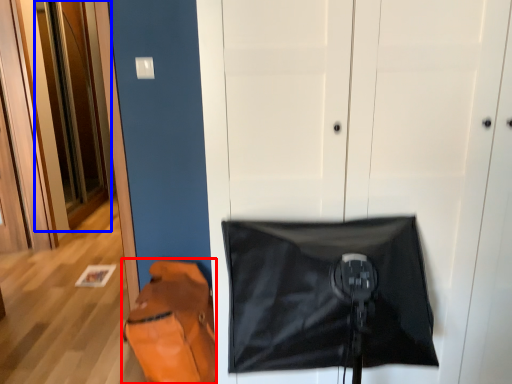
Question: Among these objects, which one is farthest to the camera, messenger bag (highlighted by a red box) or door (highlighted by a blue box)?

Choices:
 (A) messenger bag
 (B) door

Answer: (B)